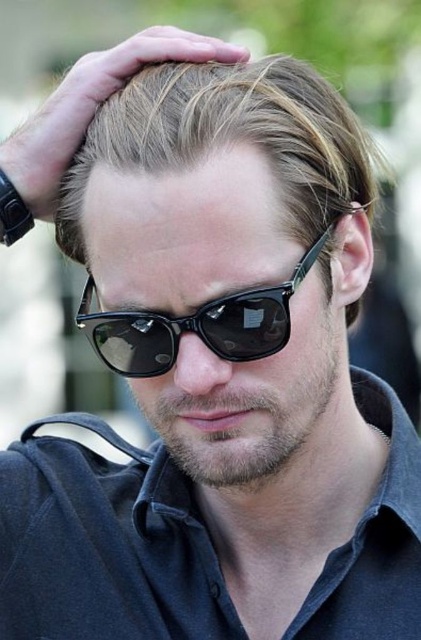
You are a photographer trying to capture a close portrait of the person. Since both the light brown smooth hair at center and the black plastic sunglasses at center are in focus, which object would appear larger in the photo?

The light brown smooth hair at center would appear larger in the photo because it is bigger than the black plastic sunglasses at center according to the description.

What is the color and material of the clothing item located at point (x=104, y=545) in the image?

The clothing item at point (x=104, y=545) is a dark blue cotton polo shirt.

You are a photographer adjusting your camera settings to focus on the subject in the image. Which object should you prioritize focusing on first, the dark blue cotton polo shirt at center or the light brown smooth hair at center, and why?

The dark blue cotton polo shirt at center is closer to the viewer than the light brown smooth hair at center, so you should prioritize focusing on the dark blue cotton polo shirt at center first.